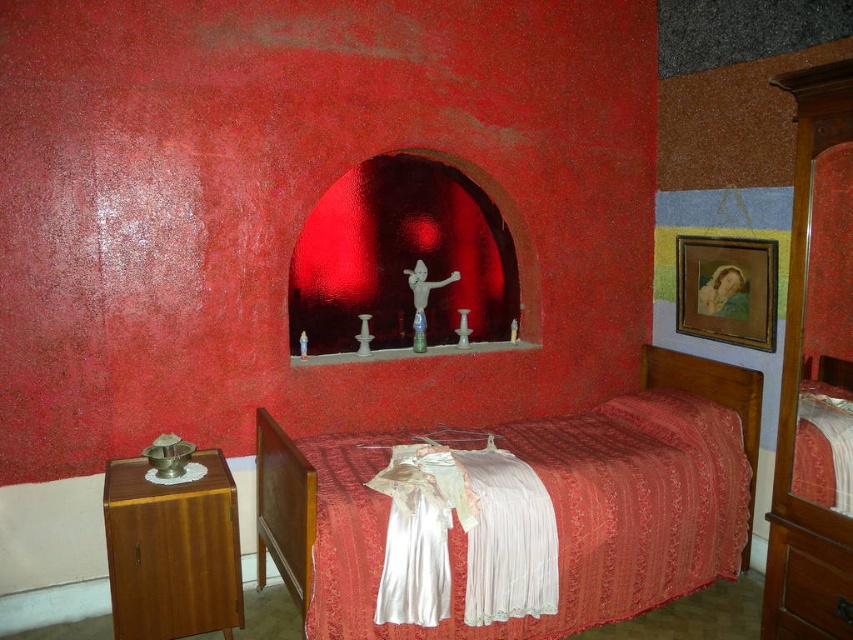
Which is above, wooden dresser at left or wooden wardrobe at right?

wooden wardrobe at right is higher up.

Can you confirm if wooden dresser at left is taller than wooden wardrobe at right?

No, wooden dresser at left is not taller than wooden wardrobe at right.

Describe the element at coordinates (172, 552) in the screenshot. I see `wooden dresser at left` at that location.

In order to click on wooden dresser at left in this screenshot , I will do `click(172, 552)`.

Does wooden dresser at left appear over silky red bed at center?

Incorrect, wooden dresser at left is not positioned above silky red bed at center.

Does wooden dresser at left have a larger size compared to silky red bed at center?

No.

Is point (146, 532) less distant than point (276, 508)?

Yes, point (146, 532) is closer to viewer.

Identify the location of wooden dresser at left. The height and width of the screenshot is (640, 853). (172, 552).

Does wooden wardrobe at right have a lesser width compared to silky red bed at center?

Correct, wooden wardrobe at right's width is less than silky red bed at center's.

Between point (766, 572) and point (718, 397), which one is positioned behind?

The point (718, 397) is behind.

Identify the location of wooden wardrobe at right. (798, 388).